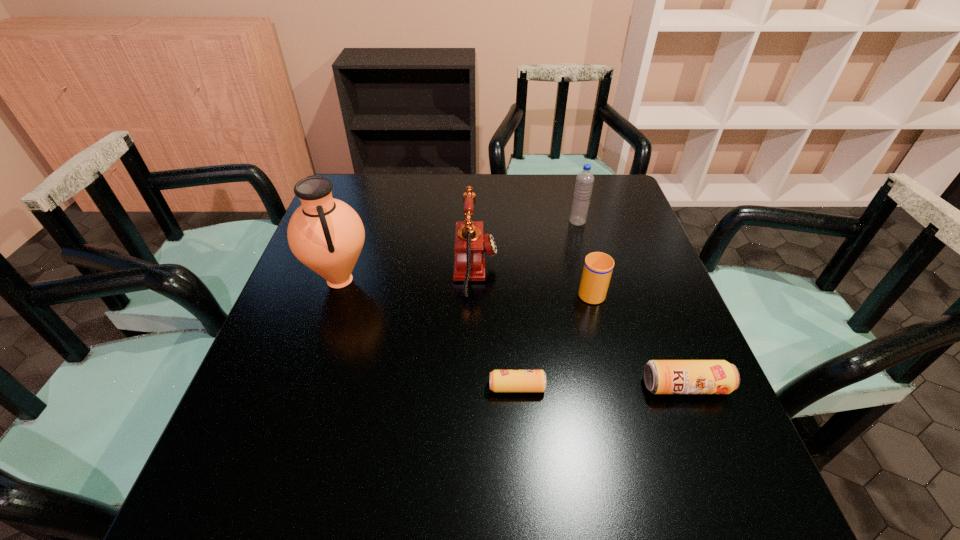
Locate an element on the screen. The height and width of the screenshot is (540, 960). water bottle located in the right edge section of the desktop is located at coordinates (584, 182).

Locate an element on the screen. Image resolution: width=960 pixels, height=540 pixels. vacant space at the far edge is located at coordinates (425, 177).

Where is `free space at the near edge of the desktop`? The width and height of the screenshot is (960, 540). free space at the near edge of the desktop is located at coordinates (337, 440).

You are a GUI agent. You are given a task and a screenshot of the screen. Output one action in this format:
    pyautogui.click(x=<x>, y=<y>)
    Task: Click on the vacant region at the left edge
    
    Given the screenshot: What is the action you would take?
    click(322, 299)

Where is `vacant space at the right edge of the desktop`? Image resolution: width=960 pixels, height=540 pixels. vacant space at the right edge of the desktop is located at coordinates (620, 339).

This screenshot has height=540, width=960. I want to click on free space at the far left corner of the desktop, so click(352, 176).

This screenshot has width=960, height=540. In the image, there is a desktop. In order to click on vacant space at the near left corner in this screenshot , I will do `click(241, 433)`.

Locate an element on the screen. This screenshot has width=960, height=540. vacant space at the far right corner of the desktop is located at coordinates (571, 178).

The width and height of the screenshot is (960, 540). In order to click on free space between the right beer can and the shorter beer can in this screenshot , I will do [601, 387].

Where is `free space between the cup and the shortest object`? This screenshot has width=960, height=540. free space between the cup and the shortest object is located at coordinates (554, 339).